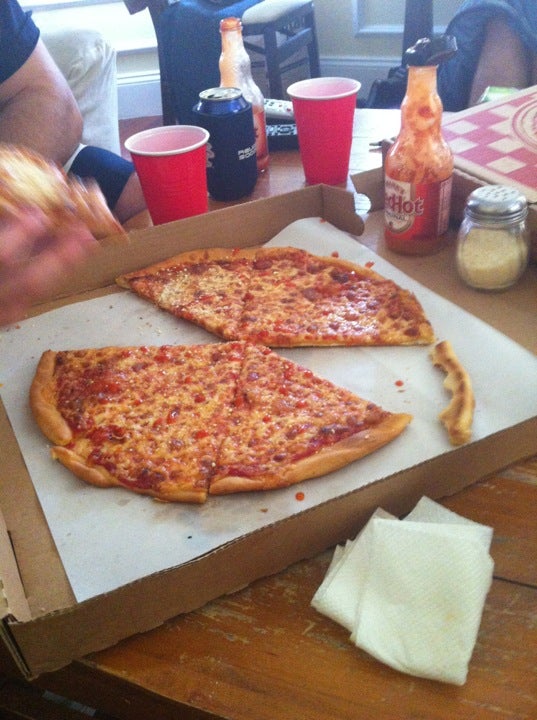
Identify the location of box. This screenshot has width=537, height=720. (201, 579).